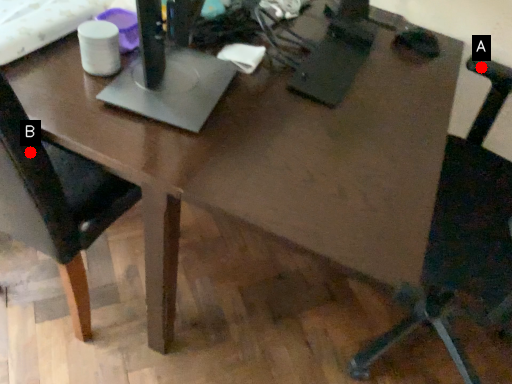
Question: Two points are circled on the image, labeled by A and B beside each circle. Among these points, which one is farthest from the camera?

Choices:
 (A) A is further
 (B) B is further

Answer: (A)